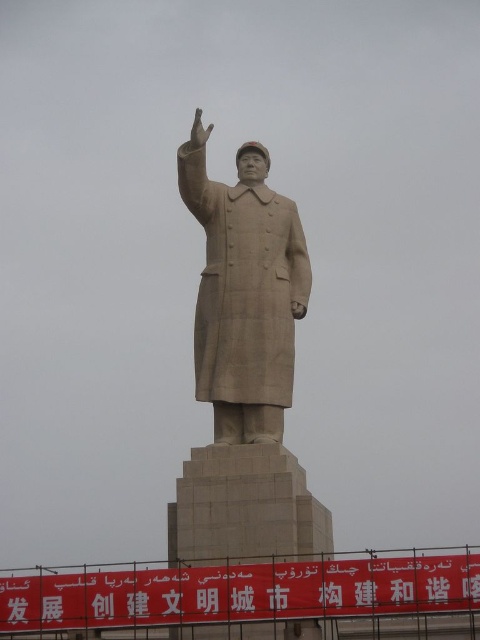
Is the position of matte stone statue at center less distant than that of matte stone hand at upper center?

That is True.

Locate an element on the screen. matte stone statue at center is located at coordinates (244, 294).

Is point (288, 200) behind point (203, 125)?

Yes, point (288, 200) is farther from viewer.

The width and height of the screenshot is (480, 640). Find the location of `matte stone statue at center`. matte stone statue at center is located at coordinates (244, 294).